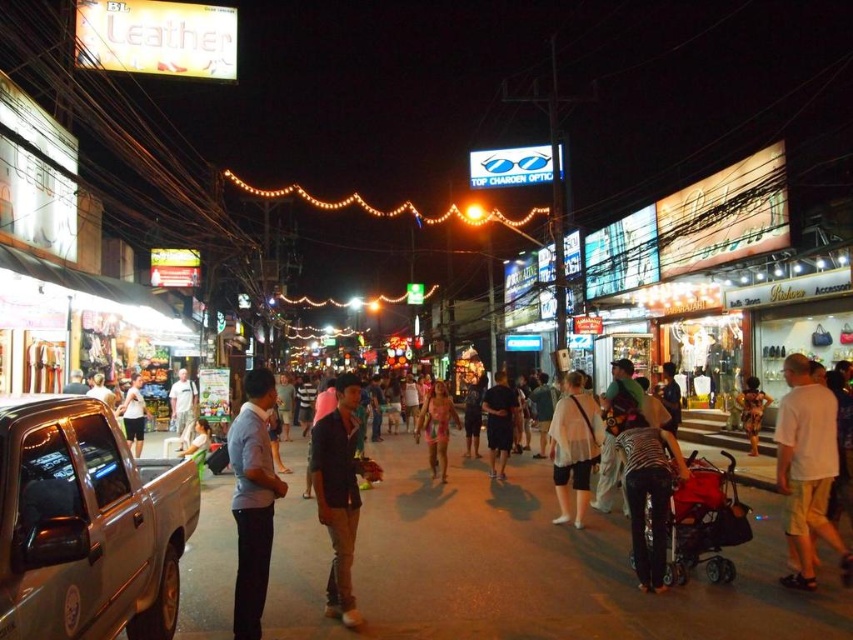
You are a customer in this busy night market and you want to buy a white cotton shirt. You see both the dark matte shirt at center and the white cotton shirt at center. Which one is on the left side?

The white cotton shirt at center is on the left side because the dark matte shirt at center is positioned on the right side of it.

You are standing at the entrance of the store next to the parked pickup truck on the left side of the street. You want to reach the white matte shirt at center. Which direction should you walk to get there?

Since the white matte shirt at center is located at coordinates approximately 0.700 in the x and 0.673 in the y, you should walk towards the center of the street from the entrance of the store next to the parked pickup truck on the left side to reach it.

You are a delivery person standing at the edge of the street in this busy night scene. You need to place a package between the white matte tank top at center and the matte black shirt at center. The package is 6 feet long. Can you fit it between them without moving either item?

The distance between the white matte tank top at center and the matte black shirt at center is 6.50 feet. Since the package is 6 feet long, it can fit between them as there is enough space.